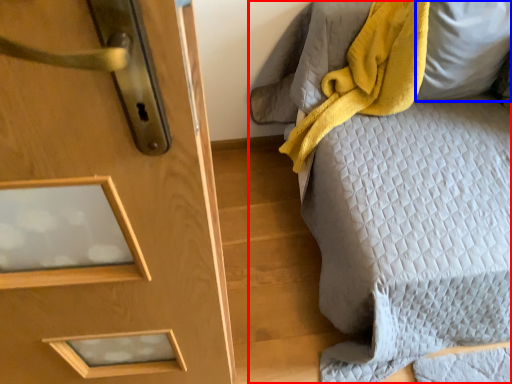
Question: Which object is closer to the camera taking this photo, furniture (highlighted by a red box) or pillow (highlighted by a blue box)?

Choices:
 (A) furniture
 (B) pillow

Answer: (A)